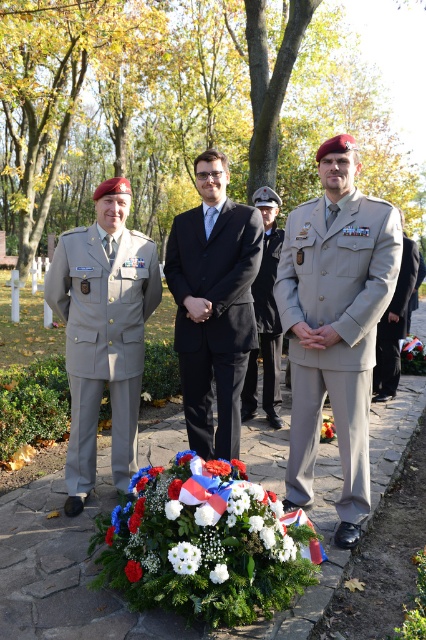
Is satin black suit at center positioned in front of white matte flower at center?

That is False.

Which is more to the left, satin black suit at center or white matte flower at center?

Positioned to the left is white matte flower at center.

Does point (247, 392) lie behind point (172, 548)?

That is True.

Where is `satin black suit at center`? satin black suit at center is located at coordinates (268, 317).

Between point (362, 433) and point (210, 440), which one is positioned in front?

Point (362, 433) is in front.

Is point (359, 486) closer to camera compared to point (186, 422)?

Yes.

Find the location of `matte khaki uniform at center`. matte khaki uniform at center is located at coordinates (336, 332).

I want to click on matte khaki uniform at center, so click(336, 332).

Does white floral bouquet at center appear under satin black suit at center?

Yes, white floral bouquet at center is below satin black suit at center.

Is white floral bouquet at center wider than satin black suit at center?

Yes.

Is point (141, 490) positioned after point (256, 300)?

No, (141, 490) is closer to viewer.

The image size is (426, 640). Find the location of `white floral bouquet at center`. white floral bouquet at center is located at coordinates (198, 522).